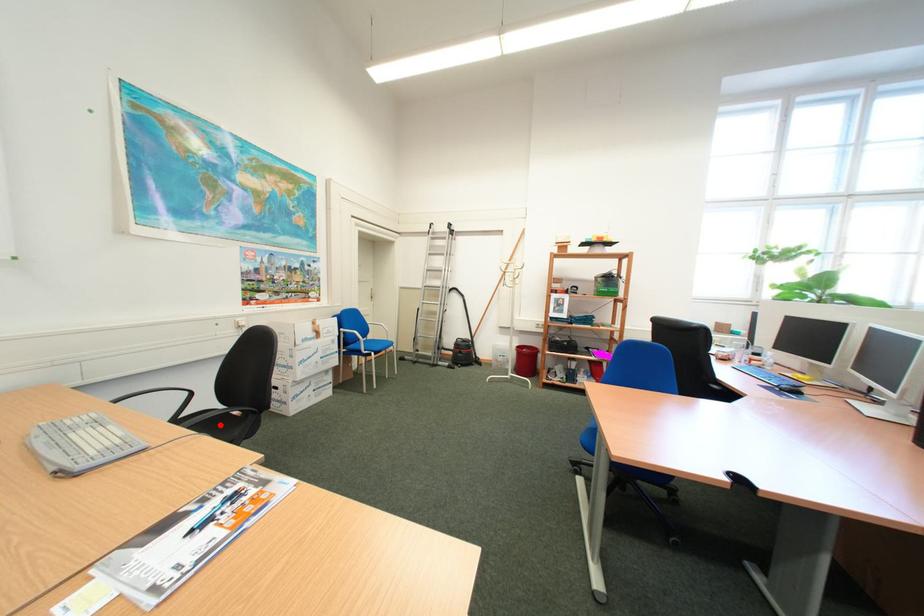
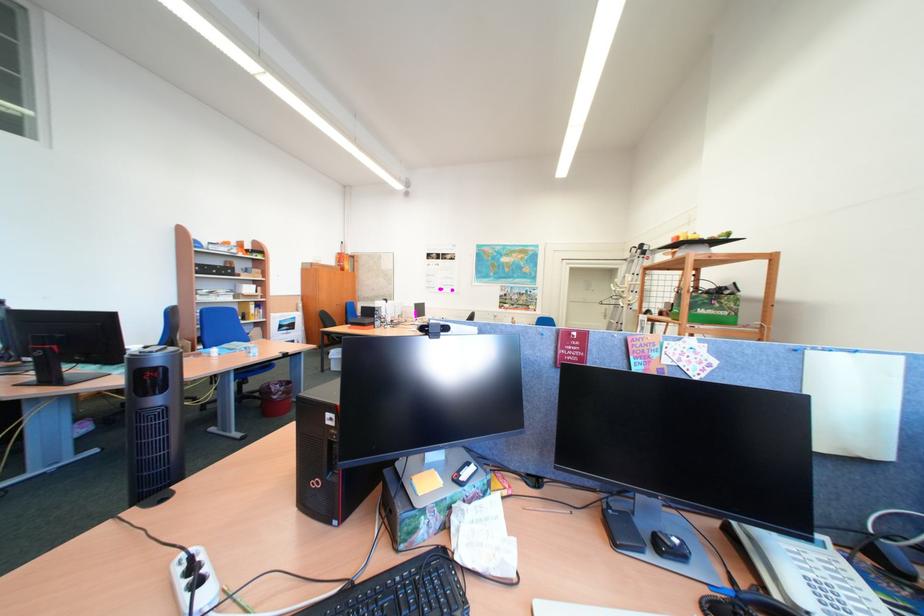
Question: I am providing you with two images of the same scene from different viewpoints. A red point is marked on the first image. Can you still see the location of the red point in image 2?

Choices:
 (A) Yes
 (B) No

Answer: (B)